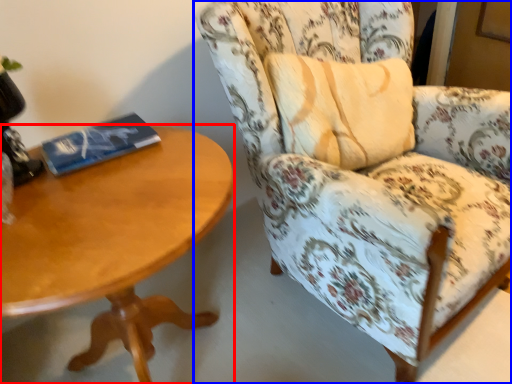
Question: Which point is closer to the camera, coffee table (highlighted by a red box) or chair (highlighted by a blue box)?

Choices:
 (A) coffee table
 (B) chair

Answer: (A)